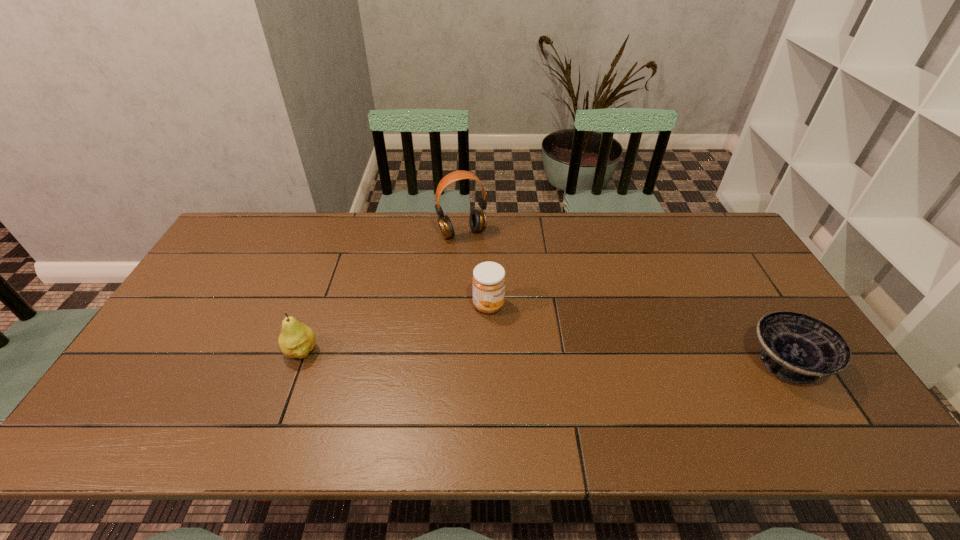
Where is `pear`? This screenshot has width=960, height=540. pear is located at coordinates (296, 340).

Find the location of `bowl`. bowl is located at coordinates (797, 348).

What are the coordinates of `the rightmost object` in the screenshot? It's located at [797, 348].

Where is `the third nearest object`? the third nearest object is located at coordinates (488, 281).

This screenshot has width=960, height=540. Find the location of `the tallest object`. the tallest object is located at coordinates (478, 221).

This screenshot has height=540, width=960. What are the coordinates of `the farthest object` in the screenshot? It's located at coord(478,221).

Identify the location of vacant area located 0.310m on the right of the pear. The image size is (960, 540). (437, 350).

Find the location of `vacant position located 0.160m on the back of the shortest object`. vacant position located 0.160m on the back of the shortest object is located at coordinates (742, 292).

Identify the location of vacant space located 0.370m on the front label of the third nearest object. (625, 377).

The image size is (960, 540). In order to click on vacant point located on the front label of the third nearest object in this screenshot , I will do `click(592, 360)`.